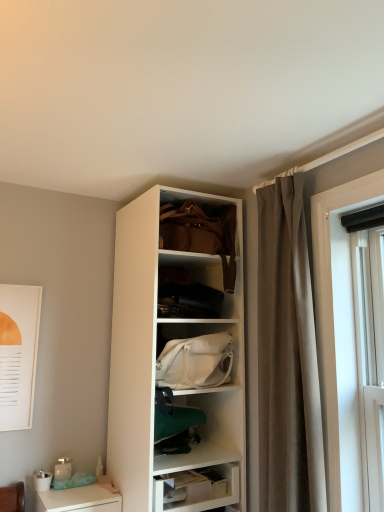
Locate an element on the screen. The width and height of the screenshot is (384, 512). free point above white glossy desk at lower left (from a real-world perspective) is located at coordinates (74, 490).